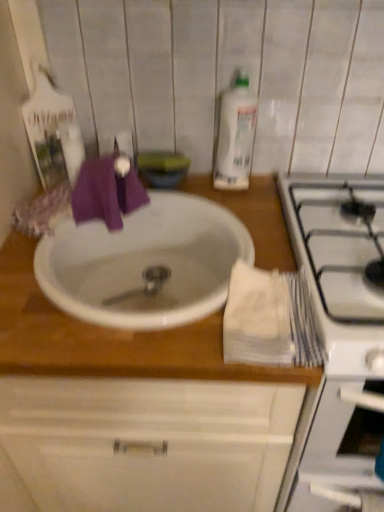
This screenshot has height=512, width=384. I want to click on free location in front of clear plastic bottle at upper center, so click(244, 209).